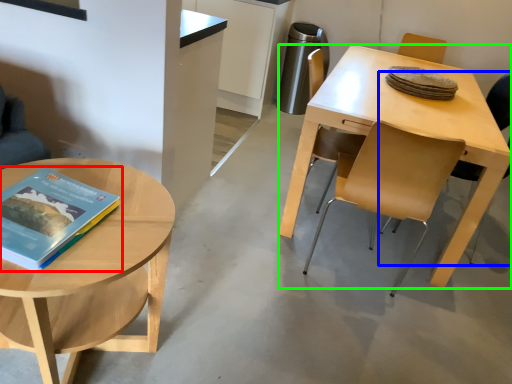
Question: Estimate the real-world distances between objects in this image. Which object is closer to book (highlighted by a red box), chair (highlighted by a blue box) or desk (highlighted by a green box)?

Choices:
 (A) chair
 (B) desk

Answer: (B)